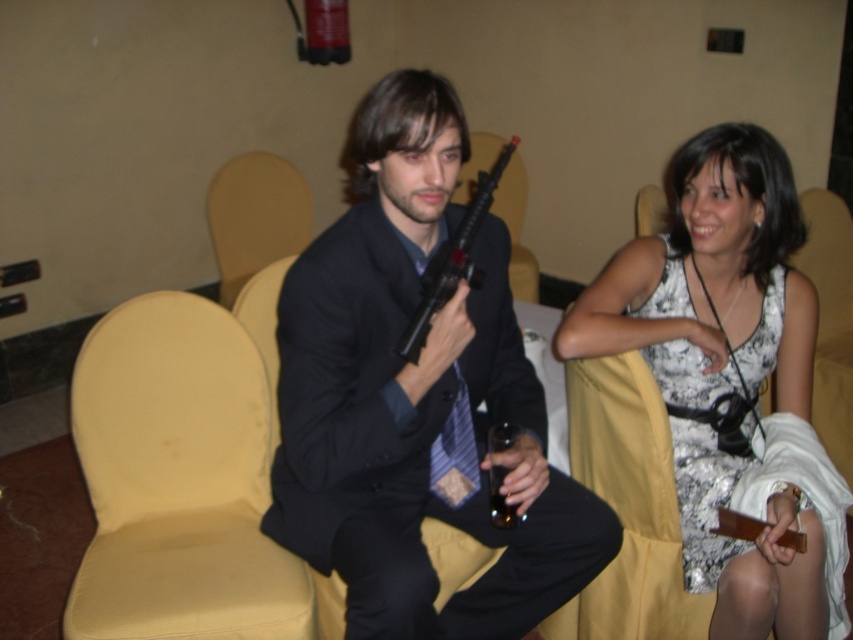
You are at a party and want to place a small gift between the white floral dress at center and the translucent glass at right. Can you fit it there?

The distance between the white floral dress at center and the translucent glass at right is 19.76 inches, so yes, you can fit a small gift between them as the space is sufficient.

You are at a social event and see the white floral dress at center and the yellow fabric chair at left. Which object is positioned higher in the image?

The white floral dress at center is above the yellow fabric chair at left, so it is positioned higher in the image.

You are a photographer standing between the two people in the scene. You want to take a photo that includes both the white floral dress at center and the other person. The camera has a maximum focus range of 1.5 meters. Will you be able to capture both subjects in focus?

The two individuals are 1.44 meters apart, which is within the camera maximum focus range of 1.5 meters. Therefore, you can capture both subjects in focus.